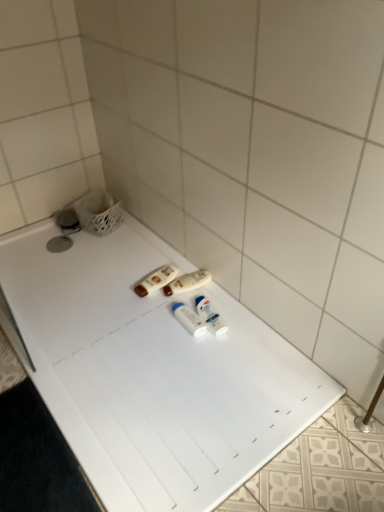
This screenshot has width=384, height=512. What are the coordinates of `empty space that is ontop of white plastic bathtub at center (from a real-world perspective)` in the screenshot? It's located at (120, 324).